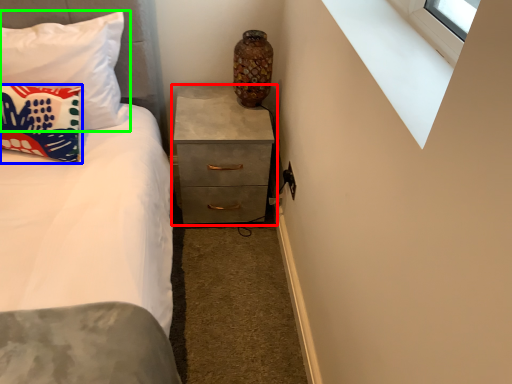
Question: Which object is the closest to the chest of drawers (highlighted by a red box)? Choose among these: pillow (highlighted by a blue box) or pillow (highlighted by a green box).

Choices:
 (A) pillow
 (B) pillow

Answer: (B)